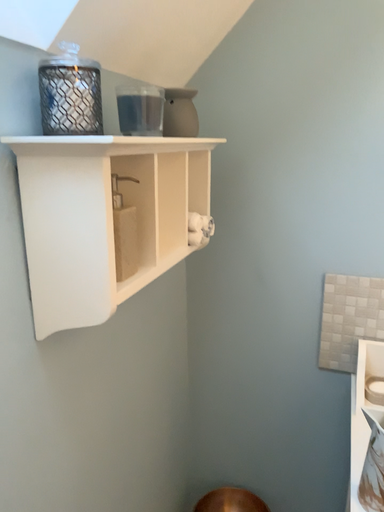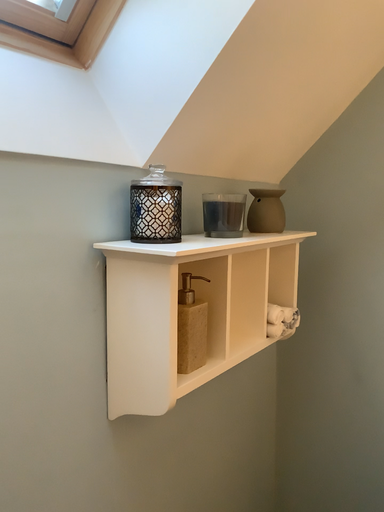
Question: How did the camera likely rotate when shooting the video?

Choices:
 (A) rotated right
 (B) rotated left

Answer: (B)